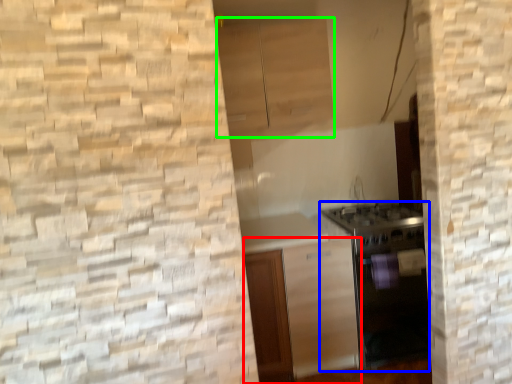
Question: Which is nearer to the cabinetry (highlighted by a red box)? oven (highlighted by a blue box) or cabinetry (highlighted by a green box).

Choices:
 (A) oven
 (B) cabinetry

Answer: (A)